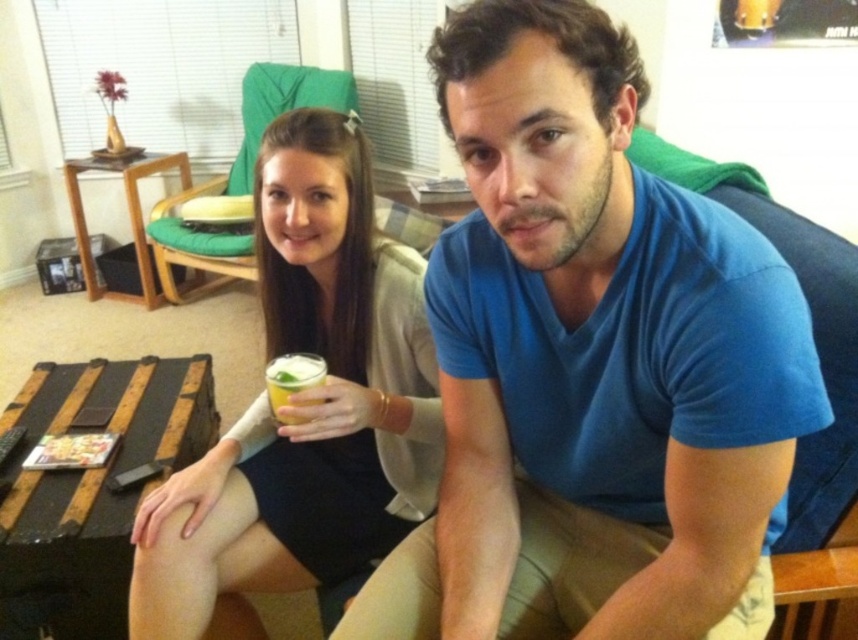
Question: Which of the following is the farthest from the observer?

Choices:
 (A) matte black dress at center
 (B) blue cotton shirt at center

Answer: (A)

Question: Does blue cotton shirt at center have a greater width compared to translucent plastic cup at center?

Choices:
 (A) no
 (B) yes

Answer: (B)

Question: Can you confirm if matte black dress at center is smaller than translucent plastic cup at center?

Choices:
 (A) no
 (B) yes

Answer: (A)

Question: Can you confirm if matte black dress at center is positioned to the left of translucent plastic cup at center?

Choices:
 (A) yes
 (B) no

Answer: (B)

Question: Which of the following is the closest to the observer?

Choices:
 (A) (439, 476)
 (B) (289, 385)
 (C) (514, 394)

Answer: (C)

Question: Based on their relative distances, which object is nearer to the blue cotton shirt at center?

Choices:
 (A) matte black dress at center
 (B) translucent plastic cup at center

Answer: (A)